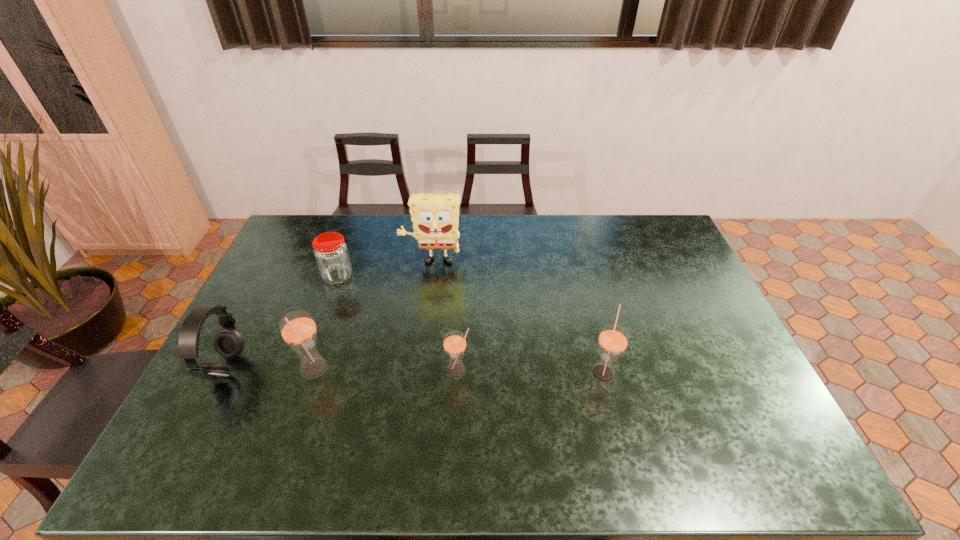
Locate an element on the screen. The height and width of the screenshot is (540, 960). vacant space located on the front of the jar is located at coordinates (324, 316).

Locate an element on the screen. The image size is (960, 540). free space located on the face of the sponge is located at coordinates (424, 325).

The width and height of the screenshot is (960, 540). In order to click on free space located 0.060m on the ear cups of the earphone in this screenshot , I will do `click(263, 368)`.

Find the location of `object positioned at the left edge`. object positioned at the left edge is located at coordinates (228, 343).

This screenshot has height=540, width=960. In order to click on vacant space at the far edge of the desktop in this screenshot , I will do `click(611, 237)`.

Identify the location of free region at the near edge of the desktop. click(550, 411).

Image resolution: width=960 pixels, height=540 pixels. In the image, there is a desktop. Identify the location of free region at the right edge. (693, 284).

Identify the location of vacant point at the far left corner. (305, 217).

Identify the location of free spot at the near left corner of the desktop. (243, 411).

Where is `vacant area that lies between the rightmost straw and the leftmost object`? vacant area that lies between the rightmost straw and the leftmost object is located at coordinates (415, 370).